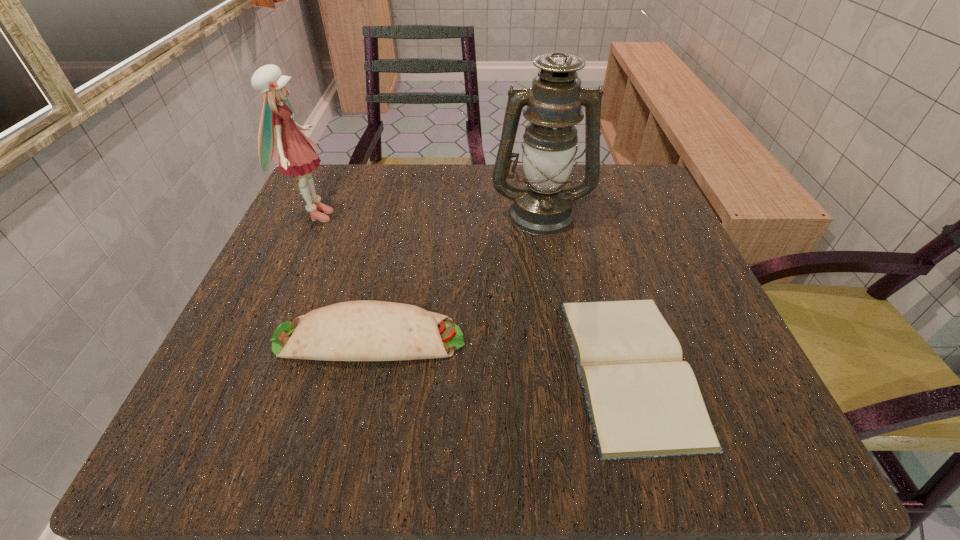
You are a GUI agent. You are given a task and a screenshot of the screen. Output one action in this format:
    pyautogui.click(x=<x>, y=<y>)
    Task: Click on the unoccupied area between the shortest object and the doll
    
    Given the screenshot: What is the action you would take?
    pos(472,292)

At what (x,y) coordinates should I click in order to perform the action: click on unoccupied position between the shortest object and the third tallest object. Please return your answer as a coordinate pair (x, y). This screenshot has width=960, height=540. Looking at the image, I should click on (500, 353).

Where is `free space that is in between the oil lamp and the Bible`? This screenshot has height=540, width=960. free space that is in between the oil lamp and the Bible is located at coordinates (586, 291).

Locate an element on the screen. free area in between the doll and the Bible is located at coordinates (472, 292).

Locate an element on the screen. free point between the Bible and the doll is located at coordinates (472, 292).

Find the location of a particular element. object that stands as the third closest to the shortest object is located at coordinates (294, 152).

The height and width of the screenshot is (540, 960). Identify the location of the third closest object to the second shortest object. (542, 206).

Where is `vacant position in the image that satisfies the following two spatial constraints: 1. at the bitten end of the third tallest object; 2. on the right side of the Bible`? vacant position in the image that satisfies the following two spatial constraints: 1. at the bitten end of the third tallest object; 2. on the right side of the Bible is located at coordinates (363, 368).

Where is `vacant region that satisfies the following two spatial constraints: 1. at the bitten end of the shortest object; 2. on the left side of the second shortest object`? vacant region that satisfies the following two spatial constraints: 1. at the bitten end of the shortest object; 2. on the left side of the second shortest object is located at coordinates (363, 368).

Locate an element on the screen. The image size is (960, 540). free point that satisfies the following two spatial constraints: 1. on the front side of the oil lamp; 2. on the right side of the shortest object is located at coordinates (567, 368).